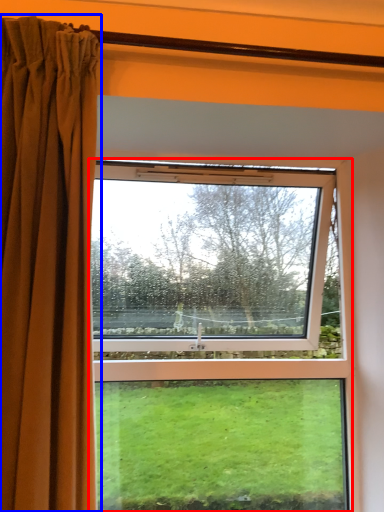
Question: Which object is further to the camera taking this photo, window (highlighted by a red box) or curtain (highlighted by a blue box)?

Choices:
 (A) window
 (B) curtain

Answer: (A)